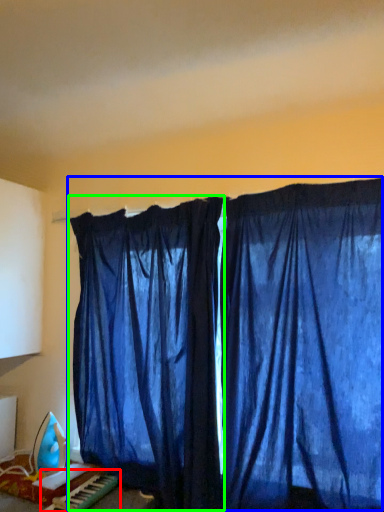
Question: Which object is the closest to the musical keyboard (highlighted by a red box)? Choose among these: curtain (highlighted by a blue box) or curtain (highlighted by a green box).

Choices:
 (A) curtain
 (B) curtain

Answer: (B)